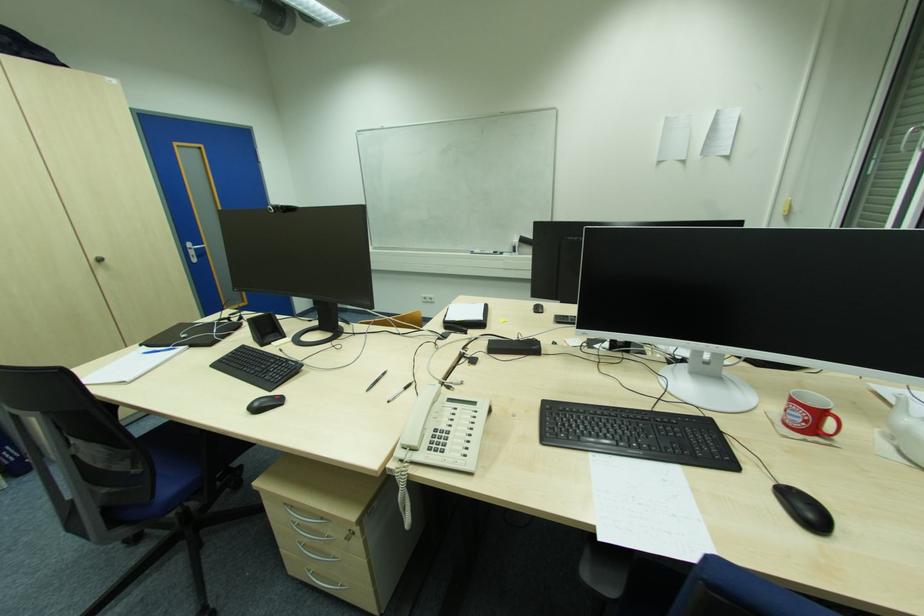
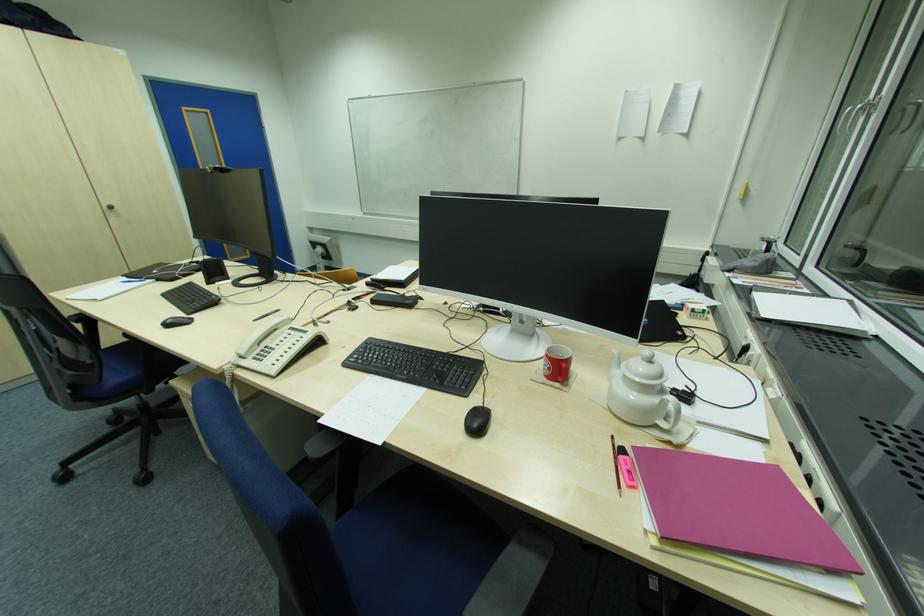
Find the pixel in the second image that matches (103,261) in the first image.

(114, 209)